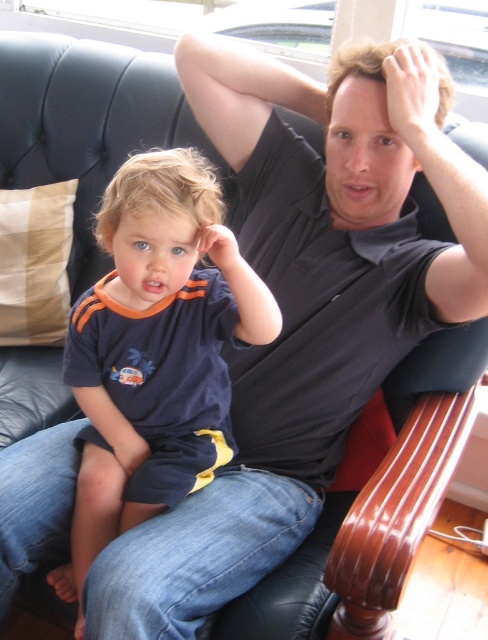
You are a photographer adjusting your camera settings to focus on two points in the image. The first point is point [341,90] and the second is point [185,205]. Which point should you focus on first if you want to capture the closest object to the camera?

Point [341,90] is closer to the camera than point [185,205], so you should focus on point [341,90] first to capture the closest object.